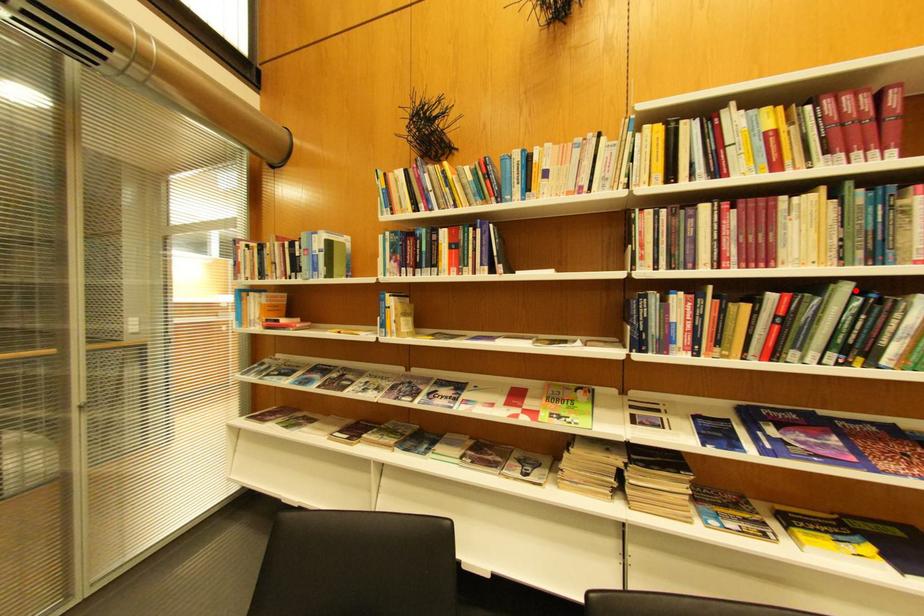
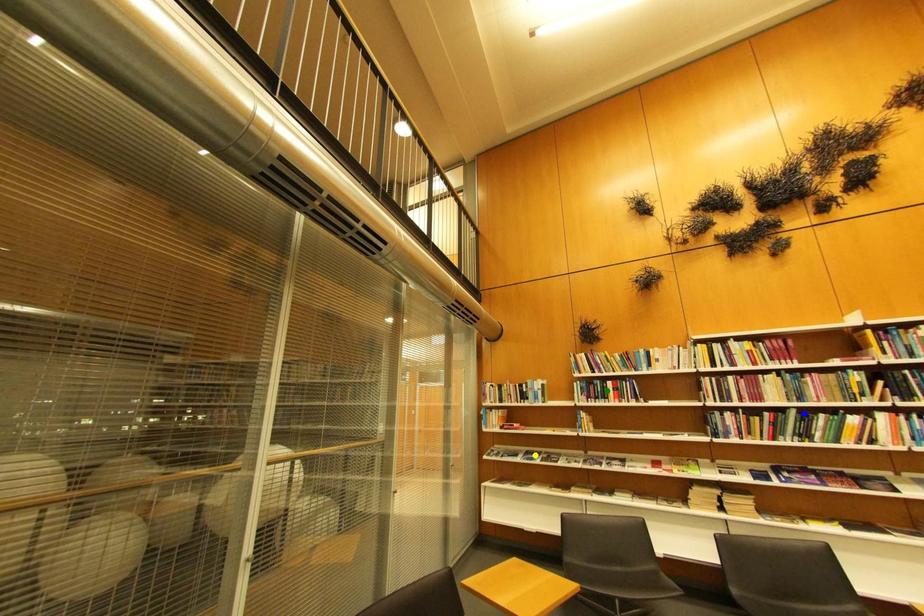
Question: I am providing you with two images of the same scene from different viewpoints. A red point is marked on the first image. You are given multiple points on the second image. Which point in image 2 is actually the same real-world point as the red point in image 1?

Choices:
 (A) blue point
 (B) yellow point
 (C) green point

Answer: (A)